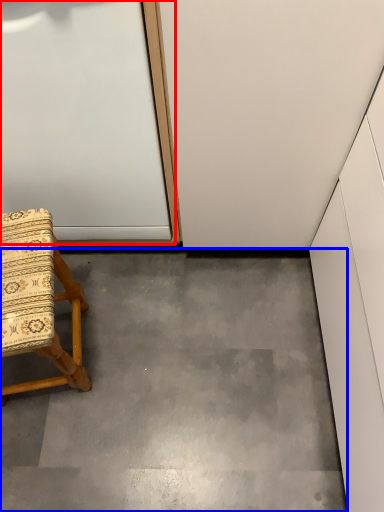
Question: Which object is closer to the camera taking this photo, door (highlighted by a red box) or concrete (highlighted by a blue box)?

Choices:
 (A) door
 (B) concrete

Answer: (A)